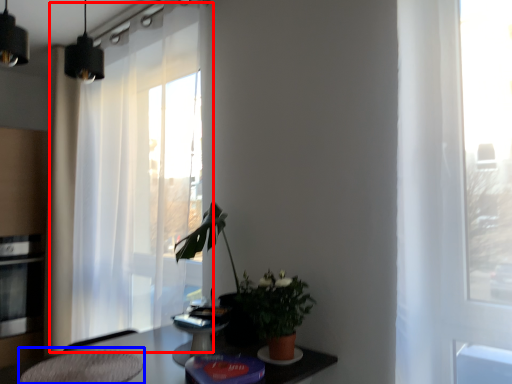
Question: Which point is further to the camera, curtain (highlighted by a red box) or swivel chair (highlighted by a blue box)?

Choices:
 (A) curtain
 (B) swivel chair

Answer: (A)